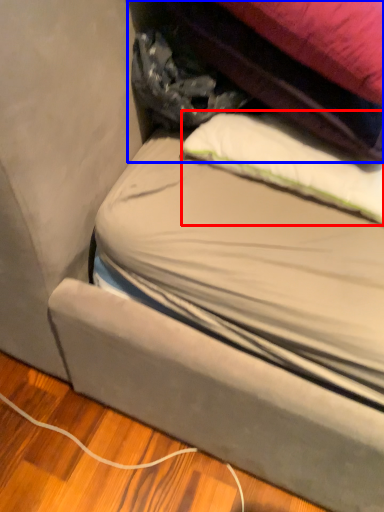
Question: Which object appears closest to the camera in this image, pillow (highlighted by a red box) or bag (highlighted by a blue box)?

Choices:
 (A) pillow
 (B) bag

Answer: (B)